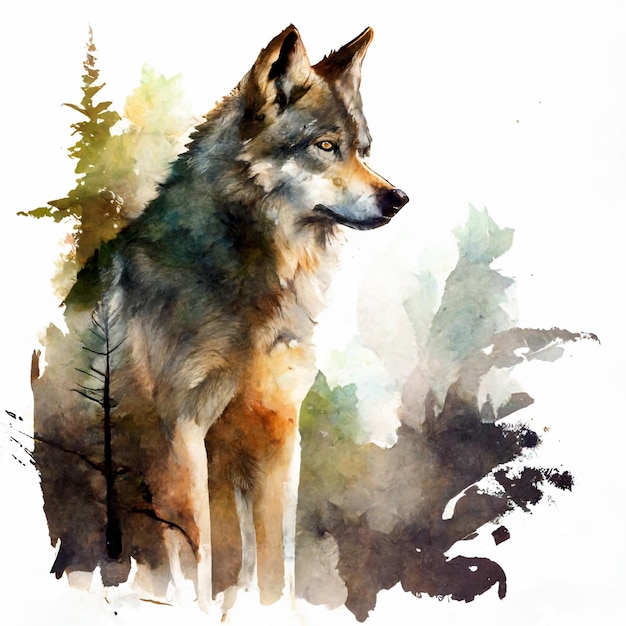
Where is `black painting of a straight tree with short branches and no leaves`? The width and height of the screenshot is (626, 626). black painting of a straight tree with short branches and no leaves is located at coordinates (106, 382), (111, 480), (111, 541).